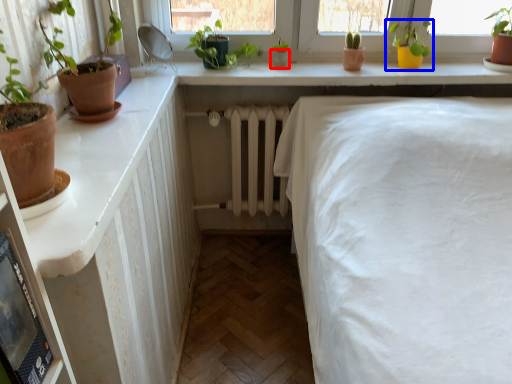
Question: Among these objects, which one is nearest to the camera, flowerpot (highlighted by a red box) or houseplant (highlighted by a blue box)?

Choices:
 (A) flowerpot
 (B) houseplant

Answer: (B)